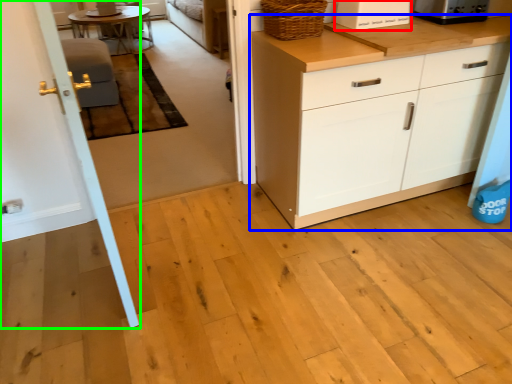
Question: Which object is positioned farthest from appliance (highlighted by a red box)? Select from cabinetry (highlighted by a blue box) and door (highlighted by a green box).

Choices:
 (A) cabinetry
 (B) door

Answer: (B)